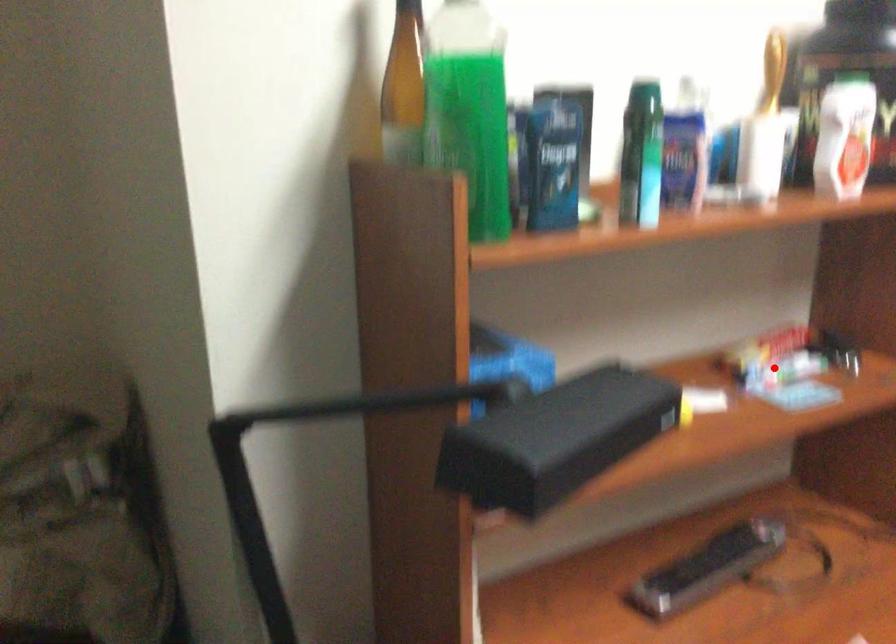
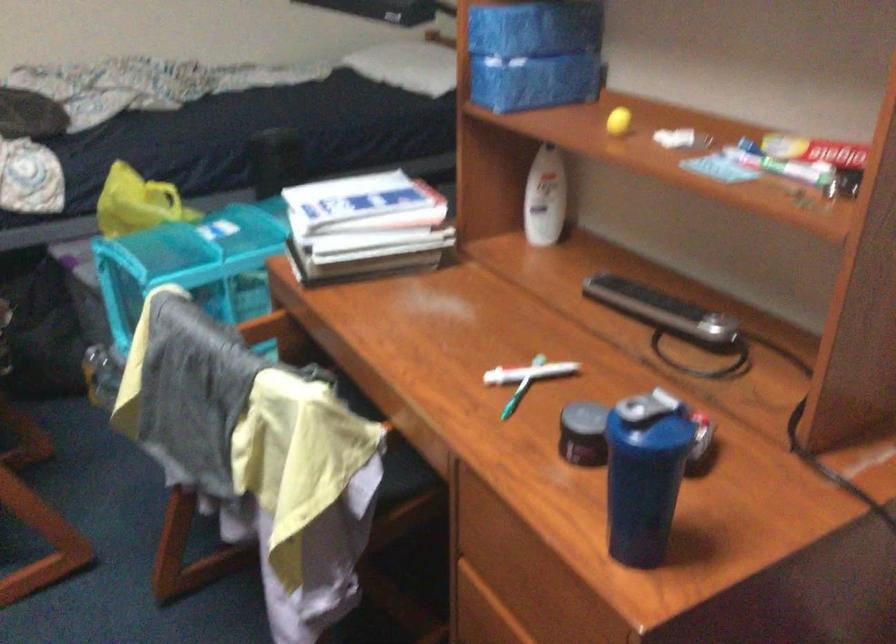
Locate, in the second image, the point that corresponds to the highlighted location in the first image.

(780, 164)